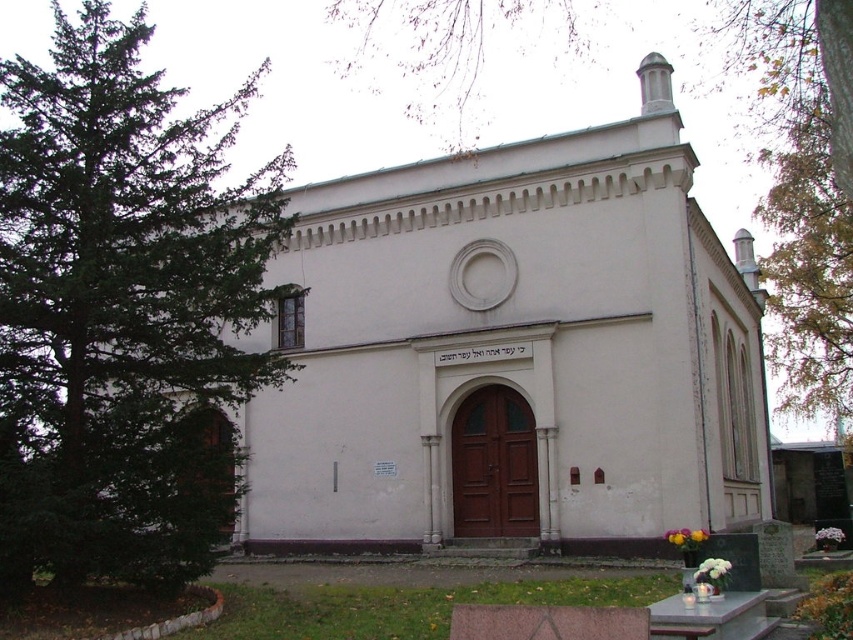
You are standing at the entrance of a cemetery and want to take a photo of the white smooth church at center. Your camera has a maximum focus range of 40 meters. Will you be able to capture the church in focus without moving closer?

The white smooth church at center is 39.24 meters away from the camera. Since the camera can focus up to 40 meters, you can capture the church in focus without moving closer.